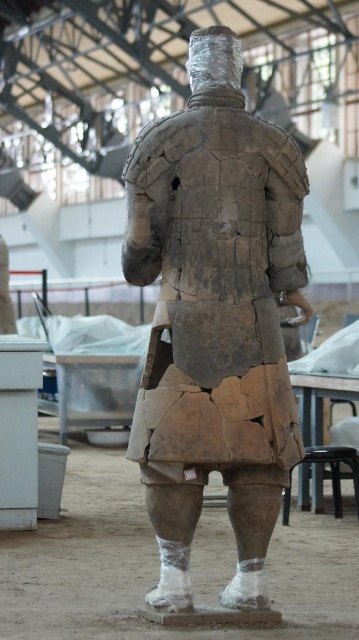
Question: Is cracked clay armor at center bigger than black plastic stool at lower right?

Choices:
 (A) no
 (B) yes

Answer: (B)

Question: Which object appears farthest from the camera in this image?

Choices:
 (A) cracked clay armor at center
 (B) black plastic stool at lower right

Answer: (B)

Question: Does cracked clay armor at center appear on the right side of black plastic stool at lower right?

Choices:
 (A) no
 (B) yes

Answer: (A)

Question: Is cracked clay armor at center positioned behind black plastic stool at lower right?

Choices:
 (A) no
 (B) yes

Answer: (A)